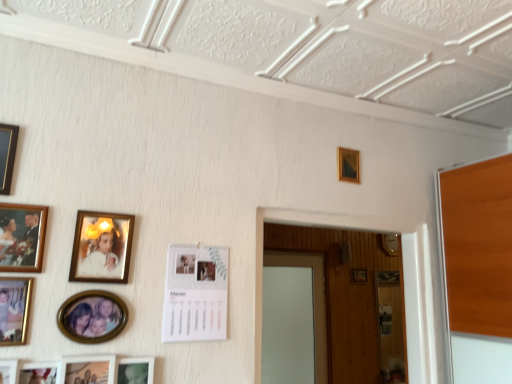
Question: Is matte silver picture frame at lower left, which ranks as the 6th picture frame in left-to-right order, outside matte black picture frame at upper left, acting as the fifth picture frame starting from the front?

Choices:
 (A) no
 (B) yes

Answer: (B)

Question: Can you confirm if matte silver picture frame at lower left, which appears as the fourth picture frame when viewed from the front, is positioned to the right of matte black picture frame at upper left, which appears as the eighth picture frame when viewed from the back?

Choices:
 (A) yes
 (B) no

Answer: (A)

Question: Is matte silver picture frame at lower left, placed as the ninth picture frame when sorted from back to front, facing away from matte black picture frame at upper left, acting as the fifth picture frame starting from the front?

Choices:
 (A) no
 (B) yes

Answer: (A)

Question: From a real-world perspective, is matte silver picture frame at lower left, which appears as the fourth picture frame when viewed from the front, located beneath matte black picture frame at upper left, the twelfth picture frame from the right?

Choices:
 (A) yes
 (B) no

Answer: (A)

Question: Is matte silver picture frame at lower left, the 7th picture frame in the right-to-left sequence, next to matte black picture frame at upper left, arranged as the 1th picture frame when viewed from the left?

Choices:
 (A) no
 (B) yes

Answer: (A)

Question: Considering the relative positions of matte silver picture frame at lower left, which appears as the fourth picture frame when viewed from the front, and matte black picture frame at upper left, acting as the fifth picture frame starting from the front, in the image provided, is matte silver picture frame at lower left, which appears as the fourth picture frame when viewed from the front, to the left of matte black picture frame at upper left, acting as the fifth picture frame starting from the front, from the viewer's perspective?

Choices:
 (A) yes
 (B) no

Answer: (B)

Question: From the image's perspective, does white paper calendar at center, marked as the tenth picture frame in a front-to-back arrangement, appear lower than matte gold picture frame at upper left, placed as the fifth picture frame when sorted from right to left?

Choices:
 (A) yes
 (B) no

Answer: (A)

Question: Does white paper calendar at center, marked as the third picture frame in a right-to-left arrangement, have a smaller size compared to matte gold picture frame at upper left, the fourth picture frame positioned from the back?

Choices:
 (A) yes
 (B) no

Answer: (B)

Question: Considering the relative positions of white paper calendar at center, the 3th picture frame in the back-to-front sequence, and matte gold picture frame at upper left, placed as the fifth picture frame when sorted from right to left, in the image provided, is white paper calendar at center, the 3th picture frame in the back-to-front sequence, to the left of matte gold picture frame at upper left, placed as the fifth picture frame when sorted from right to left, from the viewer's perspective?

Choices:
 (A) yes
 (B) no

Answer: (B)

Question: Considering the relative positions of white paper calendar at center, the 3th picture frame in the back-to-front sequence, and matte gold picture frame at upper left, placed as the fifth picture frame when sorted from right to left, in the image provided, is white paper calendar at center, the 3th picture frame in the back-to-front sequence, to the right of matte gold picture frame at upper left, placed as the fifth picture frame when sorted from right to left, from the viewer's perspective?

Choices:
 (A) yes
 (B) no

Answer: (A)

Question: Considering the relative sizes of white paper calendar at center, marked as the third picture frame in a right-to-left arrangement, and matte gold picture frame at upper left, the 8th picture frame from the left, in the image provided, is white paper calendar at center, marked as the third picture frame in a right-to-left arrangement, wider than matte gold picture frame at upper left, the 8th picture frame from the left,?

Choices:
 (A) no
 (B) yes

Answer: (B)

Question: Does white paper calendar at center, the tenth picture frame in the left-to-right sequence, turn towards matte gold picture frame at upper left, the fourth picture frame positioned from the back?

Choices:
 (A) yes
 (B) no

Answer: (B)

Question: Is matte black picture frame at lower left, acting as the second picture frame starting from the front, closer to camera compared to matte silver picture frame at lower left, which ranks as the 6th picture frame in left-to-right order?

Choices:
 (A) no
 (B) yes

Answer: (B)